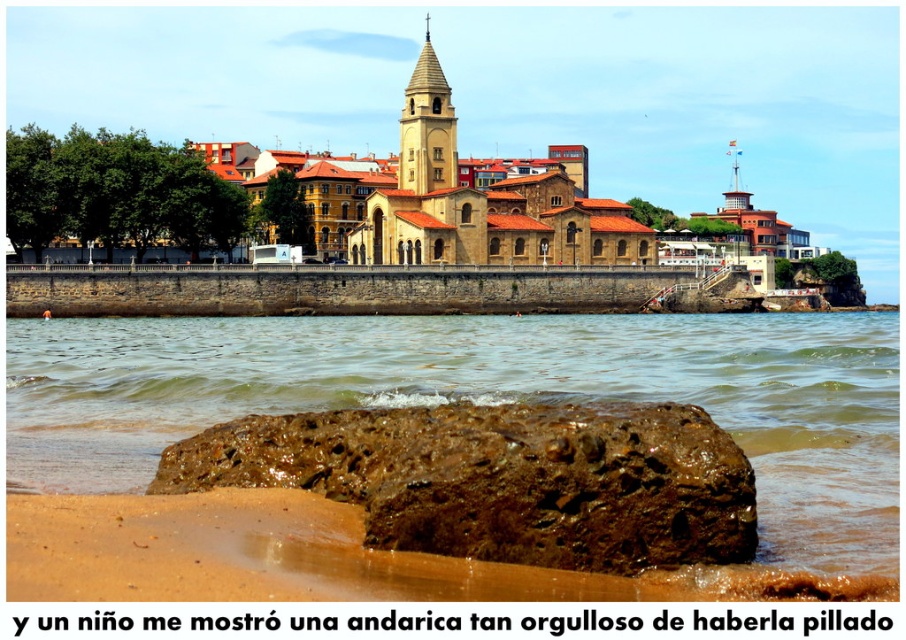
Question: Can you confirm if brown rough rock at lower center is wider than smooth stone tower at upper center?

Choices:
 (A) no
 (B) yes

Answer: (B)

Question: Can you confirm if brown wet sand at lower center is bigger than brown rough rock at lower center?

Choices:
 (A) no
 (B) yes

Answer: (B)

Question: Is the position of brown wet sand at lower center more distant than that of brown rough rock at lower center?

Choices:
 (A) yes
 (B) no

Answer: (B)

Question: Which object is closer to the camera taking this photo?

Choices:
 (A) smooth stone tower at upper center
 (B) brown wet sand at lower center
 (C) brown rough rock at lower center

Answer: (B)

Question: Which point is closer to the camera taking this photo?

Choices:
 (A) (511, 534)
 (B) (120, 328)
 (C) (420, 132)

Answer: (A)

Question: Among these objects, which one is nearest to the camera?

Choices:
 (A) brown rough rock at lower center
 (B) smooth stone tower at upper center

Answer: (A)